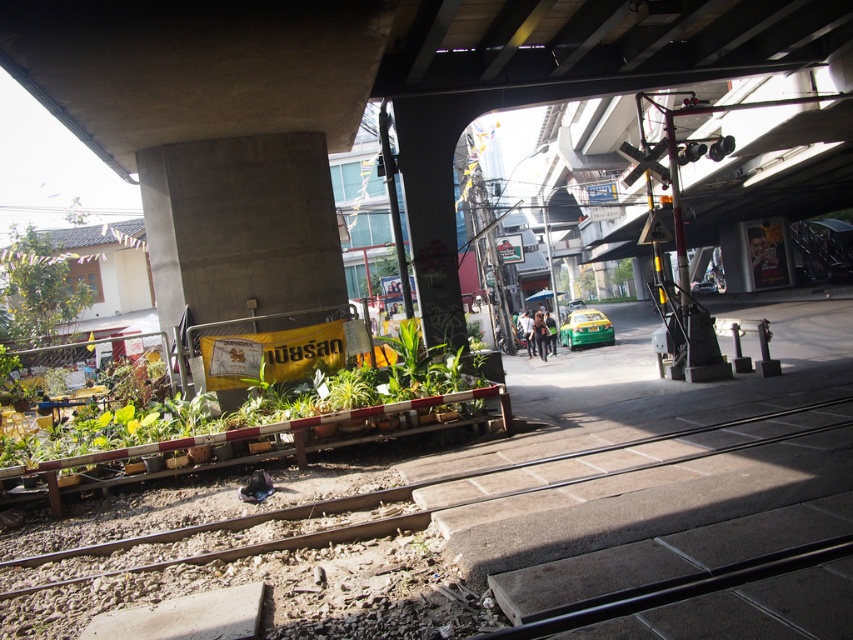
Between point (242, 429) and point (44, 333), which one is positioned in front?

Point (242, 429)

Between point (236, 528) and point (32, 275), which one is positioned behind?

Point (32, 275)

Is point (247, 516) positioned in front of point (41, 243)?

Yes, point (247, 516) is closer to viewer.

Image resolution: width=853 pixels, height=640 pixels. Find the location of `brown wooden train track at lower left`. brown wooden train track at lower left is located at coordinates (392, 490).

Can you confirm if brown wooden train track at lower left is shorter than green matte taxi at center?

Yes, brown wooden train track at lower left is shorter than green matte taxi at center.

Does point (376, 522) lie in front of point (704, 291)?

Yes, it is in front of point (704, 291).

Where is `brown wooden train track at lower left`? This screenshot has height=640, width=853. brown wooden train track at lower left is located at coordinates pyautogui.click(x=392, y=490).

Can you confirm if green leafy plants at left is taller than green glossy taxi at center?

No.

Is green leafy plants at left wider than green glossy taxi at center?

Incorrect, green leafy plants at left's width does not surpass green glossy taxi at center's.

The image size is (853, 640). Find the location of `green leafy plants at left`. green leafy plants at left is located at coordinates (247, 432).